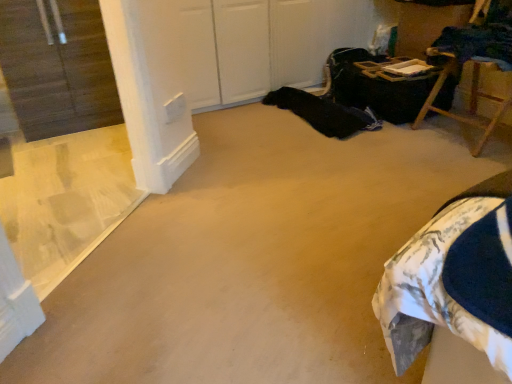
Image resolution: width=512 pixels, height=384 pixels. In order to click on free region on the left part of wooden folding chair at upper right in this screenshot , I will do (401, 145).